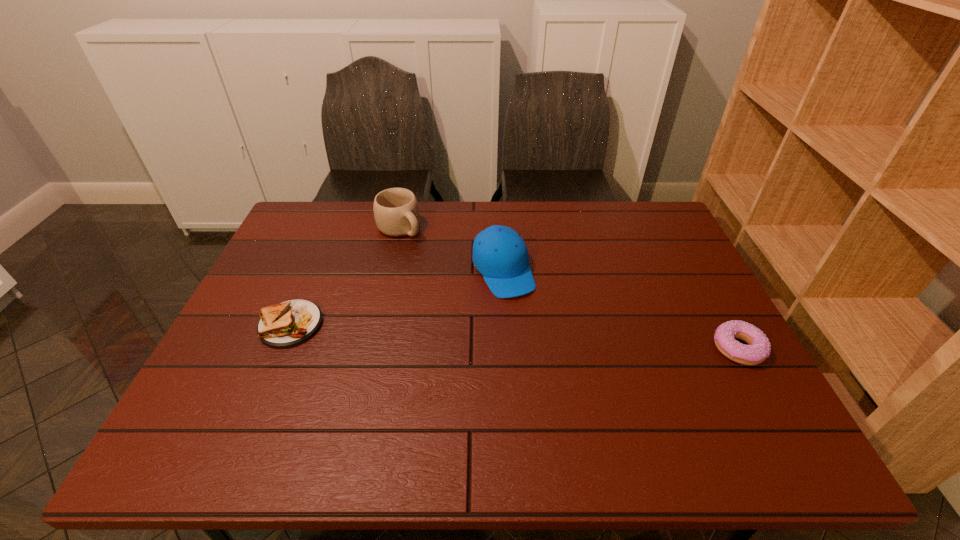
I want to click on free space at the right edge of the desktop, so 654,305.

This screenshot has width=960, height=540. I want to click on free space at the far left corner of the desktop, so click(x=327, y=241).

In order to click on vacant space at the far right corner in this screenshot , I will do `click(641, 222)`.

This screenshot has width=960, height=540. I want to click on free space between the farthest object and the doughnut, so click(x=569, y=288).

This screenshot has width=960, height=540. I want to click on vacant space that is in between the third object from left to right and the leftmost object, so click(397, 298).

Image resolution: width=960 pixels, height=540 pixels. In order to click on free space that is in between the sandwich and the rightmost object in this screenshot , I will do `click(515, 336)`.

Find the location of a particular element. vacant space in between the third object from right to left and the rightmost object is located at coordinates (569, 288).

The image size is (960, 540). In order to click on free space between the rightmost object and the third object from left to right in this screenshot , I will do `click(620, 309)`.

Where is `free area in between the mug and the second farthest object`? This screenshot has height=540, width=960. free area in between the mug and the second farthest object is located at coordinates (451, 249).

What are the coordinates of `empty location between the mug and the leftmost object` in the screenshot? It's located at (346, 276).